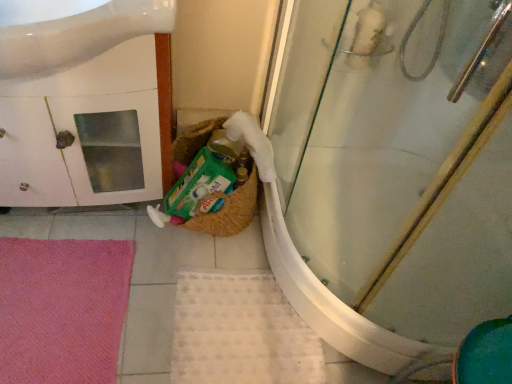
Describe the element at coordinates (240, 332) in the screenshot. I see `white textured bath mat at lower center, which appears as the 1th bath mat when viewed from the right` at that location.

Describe the element at coordinates (86, 106) in the screenshot. I see `white glossy cabinet at left` at that location.

Find the location of a particular element. white glossy sink at upper left is located at coordinates (72, 31).

I want to click on white textured bath mat at lower center, the 2th bath mat from the left, so point(240,332).

Considering the positions of objects transparent glass shower door at center and pink soft bath mat at lower left, which appears as the second bath mat when viewed from the right, in the image provided, who is behind, transparent glass shower door at center or pink soft bath mat at lower left, which appears as the second bath mat when viewed from the right,?

pink soft bath mat at lower left, which appears as the second bath mat when viewed from the right, is behind.

Is point (302, 145) in front of point (96, 319)?

No.

From a real-world perspective, between transparent glass shower door at center and pink soft bath mat at lower left, which appears as the second bath mat when viewed from the right, who is vertically higher?

From a 3D spatial view, transparent glass shower door at center is above.

From their relative heights in the image, would you say transparent glass shower door at center is taller or shorter than pink soft bath mat at lower left, which is the 1th bath mat in left-to-right order?

Considering their sizes, transparent glass shower door at center has more height than pink soft bath mat at lower left, which is the 1th bath mat in left-to-right order.

Identify the location of bathroom cabinet located above the pink soft bath mat at lower left, which appears as the second bath mat when viewed from the right (from a real-world perspective). (86, 106).

Would you say pink soft bath mat at lower left, which appears as the second bath mat when viewed from the right, is part of white glossy cabinet at left's contents?

No, white glossy cabinet at left does not contain pink soft bath mat at lower left, which appears as the second bath mat when viewed from the right.

How different are the orientations of white glossy cabinet at left and pink soft bath mat at lower left, which appears as the second bath mat when viewed from the right, in degrees?

4.21 degrees separate the facing orientations of white glossy cabinet at left and pink soft bath mat at lower left, which appears as the second bath mat when viewed from the right.

Is point (27, 2) less distant than point (45, 319)?

Yes, it is in front of point (45, 319).

Between white glossy cabinet at left and white textured bath mat at lower center, which appears as the 1th bath mat when viewed from the right, which one is positioned behind?

Positioned behind is white textured bath mat at lower center, which appears as the 1th bath mat when viewed from the right.

Can you tell me how much white glossy cabinet at left and white textured bath mat at lower center, which appears as the 1th bath mat when viewed from the right, differ in facing direction?

There is a 5.26-degree angle between the facing directions of white glossy cabinet at left and white textured bath mat at lower center, which appears as the 1th bath mat when viewed from the right.

Is white glossy cabinet at left far away from white textured bath mat at lower center, the 2th bath mat from the left?

white glossy cabinet at left is near white textured bath mat at lower center, the 2th bath mat from the left, not far away.

Could you tell me if white glossy cabinet at left is facing white textured bath mat at lower center, which appears as the 1th bath mat when viewed from the right?

No, white glossy cabinet at left is not oriented towards white textured bath mat at lower center, which appears as the 1th bath mat when viewed from the right.

Locate an element on the screen. The height and width of the screenshot is (384, 512). bathroom cabinet above the pink soft bath mat at lower left, which appears as the second bath mat when viewed from the right (from the image's perspective) is located at coordinates (86, 106).

Is pink soft bath mat at lower left, which appears as the second bath mat when viewed from the right, inside the boundaries of white glossy cabinet at left, or outside?

pink soft bath mat at lower left, which appears as the second bath mat when viewed from the right, is outside white glossy cabinet at left.

Considering their positions, is pink soft bath mat at lower left, which appears as the second bath mat when viewed from the right, located in front of or behind white glossy cabinet at left?

pink soft bath mat at lower left, which appears as the second bath mat when viewed from the right, is positioned farther from the viewer than white glossy cabinet at left.

Which is behind, transparent glass shower door at center or white textured bath mat at lower center, which appears as the 1th bath mat when viewed from the right?

Positioned behind is white textured bath mat at lower center, which appears as the 1th bath mat when viewed from the right.

Is transparent glass shower door at center shorter than white textured bath mat at lower center, which appears as the 1th bath mat when viewed from the right?

A: No.

Is transparent glass shower door at center positioned far away from white textured bath mat at lower center, the 2th bath mat from the left?

That's not correct — transparent glass shower door at center is a little close to white textured bath mat at lower center, the 2th bath mat from the left.

From a real-world perspective, which is physically below, white glossy sink at upper left or transparent glass shower door at center?

transparent glass shower door at center.

From the image's perspective, which is above, white glossy sink at upper left or transparent glass shower door at center?

white glossy sink at upper left, from the image's perspective.

Is there a large distance between white glossy sink at upper left and transparent glass shower door at center?

→ No, there isn't a large distance between white glossy sink at upper left and transparent glass shower door at center.

Which object is further away from the camera taking this photo, white glossy sink at upper left or transparent glass shower door at center?

white glossy sink at upper left is more distant.

How many degrees apart are the facing directions of white textured bath mat at lower center, which appears as the 1th bath mat when viewed from the right, and transparent glass shower door at center?

87.4 degrees.

From a real-world perspective, is white textured bath mat at lower center, which appears as the 1th bath mat when viewed from the right, above or below transparent glass shower door at center?

From a real-world perspective, white textured bath mat at lower center, which appears as the 1th bath mat when viewed from the right, is physically below transparent glass shower door at center.

From the picture: Is white textured bath mat at lower center, the 2th bath mat from the left, situated inside transparent glass shower door at center or outside?

white textured bath mat at lower center, the 2th bath mat from the left, is outside transparent glass shower door at center.

From the image's perspective, is white textured bath mat at lower center, which appears as the 1th bath mat when viewed from the right, beneath transparent glass shower door at center?

Yes, from the image's perspective, white textured bath mat at lower center, which appears as the 1th bath mat when viewed from the right, is below transparent glass shower door at center.

Find the location of a particular element. bath mat that is the 1st object located behind the transparent glass shower door at center is located at coordinates (62, 309).

From the image's perspective, which bath mat is the 1st one below the white glossy cabinet at left? Please provide its 2D coordinates.

[(62, 309)]

Consider the image. Which object lies further to the anchor point white glossy cabinet at left, white textured bath mat at lower center, the 2th bath mat from the left, or transparent glass shower door at center?

transparent glass shower door at center.

Estimate the real-world distances between objects in this image. Which object is closer to pink soft bath mat at lower left, which is the 1th bath mat in left-to-right order, white glossy sink at upper left or transparent glass shower door at center?

Based on the image, white glossy sink at upper left appears to be nearer to pink soft bath mat at lower left, which is the 1th bath mat in left-to-right order.

Which object lies further to the anchor point white textured bath mat at lower center, the 2th bath mat from the left, transparent glass shower door at center or white glossy sink at upper left?

Based on the image, white glossy sink at upper left appears to be further to white textured bath mat at lower center, the 2th bath mat from the left.

Looking at the image, which one is located closer to white glossy cabinet at left, white glossy sink at upper left or white textured bath mat at lower center, the 2th bath mat from the left?

white glossy sink at upper left is closer to white glossy cabinet at left.

Estimate the real-world distances between objects in this image. Which object is further from transparent glass shower door at center, white glossy sink at upper left or white textured bath mat at lower center, the 2th bath mat from the left?

white glossy sink at upper left.

When comparing their distances from white textured bath mat at lower center, the 2th bath mat from the left, does transparent glass shower door at center or pink soft bath mat at lower left, which appears as the second bath mat when viewed from the right, seem further?

transparent glass shower door at center.

Which object lies further to the anchor point white textured bath mat at lower center, the 2th bath mat from the left, transparent glass shower door at center or white glossy cabinet at left?

white glossy cabinet at left is positioned further to the anchor white textured bath mat at lower center, the 2th bath mat from the left.

From the image, which object appears to be farther from white glossy cabinet at left, transparent glass shower door at center or white textured bath mat at lower center, the 2th bath mat from the left?

Among the two, transparent glass shower door at center is located further to white glossy cabinet at left.

This screenshot has height=384, width=512. What are the coordinates of `bath mat situated between pink soft bath mat at lower left, which is the 1th bath mat in left-to-right order, and transparent glass shower door at center from left to right` in the screenshot? It's located at (240, 332).

At what (x,y) coordinates should I click in order to perform the action: click on bath mat between white glossy sink at upper left and transparent glass shower door at center in the horizontal direction. Please return your answer as a coordinate pair (x, y). Looking at the image, I should click on (240, 332).

This screenshot has width=512, height=384. In order to click on bathroom cabinet between white glossy sink at upper left and pink soft bath mat at lower left, which is the 1th bath mat in left-to-right order, in the up-down direction in this screenshot , I will do `click(86, 106)`.

This screenshot has width=512, height=384. Identify the location of bathroom cabinet that lies between white glossy sink at upper left and white textured bath mat at lower center, which appears as the 1th bath mat when viewed from the right, from top to bottom. (86, 106).